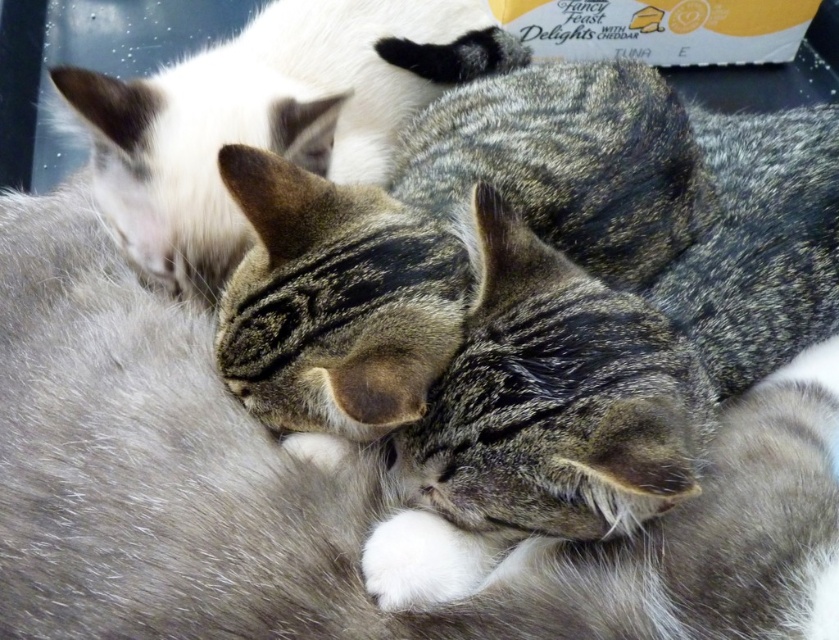
Question: Which point is closer to the camera taking this photo?

Choices:
 (A) (x=280, y=6)
 (B) (x=347, y=426)

Answer: (B)

Question: Which of the following is the closest to the observer?

Choices:
 (A) tabby fur cat at upper left
 (B) tabby fur cat at center

Answer: (B)

Question: Observing the image, what is the correct spatial positioning of tabby fur cat at center in reference to tabby fur cat at upper left?

Choices:
 (A) below
 (B) above

Answer: (A)

Question: Does tabby fur cat at center appear under tabby fur cat at upper left?

Choices:
 (A) no
 (B) yes

Answer: (B)

Question: Can you confirm if tabby fur cat at center is bigger than tabby fur cat at upper left?

Choices:
 (A) yes
 (B) no

Answer: (A)